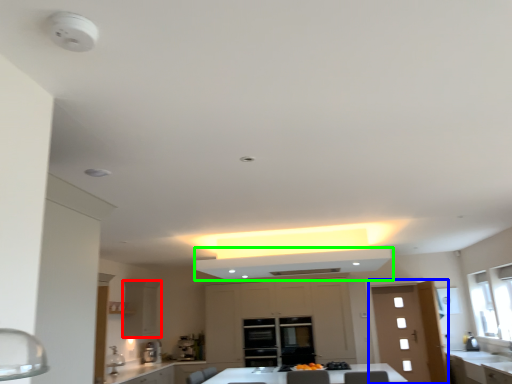
Question: Based on their relative distances, which object is nearer to cabinetry (highlighted by a red box)? Choose from door (highlighted by a blue box) and exhaust hood (highlighted by a green box).

Choices:
 (A) door
 (B) exhaust hood

Answer: (B)